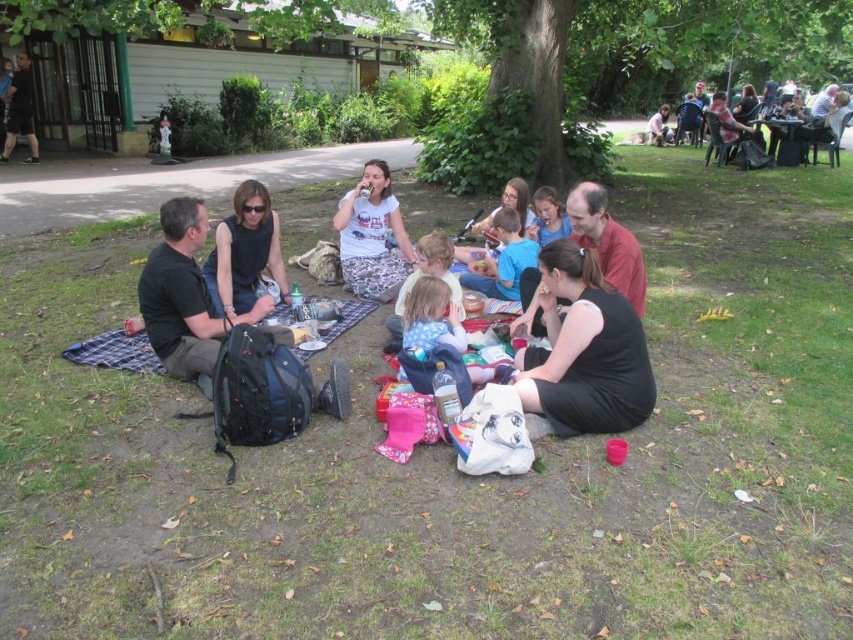
From the picture: You are a photographer trying to capture a candid shot of the black sleeveless top at center without including the matte black backpack at lower left in the frame. Based on their positions, is this possible?

The matte black backpack at lower left is below the black sleeveless top at center, so it is positioned lower. Since the backpack is below the top, you can adjust your angle or zoom to frame the top without including the backpack.